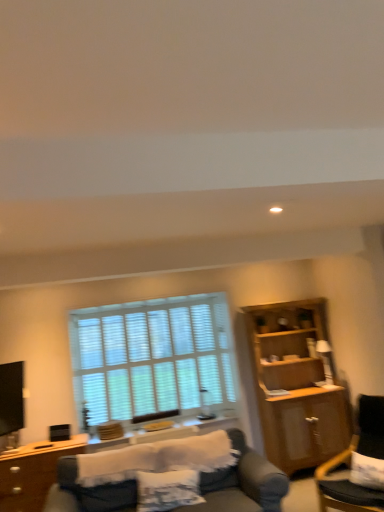
Describe the element at coordinates (153, 357) in the screenshot. This screenshot has height=512, width=384. I see `white wood blinds at center` at that location.

The image size is (384, 512). What are the coordinates of `wooden side table at lower center` in the screenshot? It's located at (167, 432).

Is dark gray fabric chair at lower right bigger than wooden cabinet at right?

No, dark gray fabric chair at lower right is not bigger than wooden cabinet at right.

From a real-world perspective, is dark gray fabric chair at lower right under wooden cabinet at right?

Yes, from a real-world perspective, dark gray fabric chair at lower right is beneath wooden cabinet at right.

Is dark gray fabric chair at lower right touching wooden cabinet at right?

No, dark gray fabric chair at lower right is not making contact with wooden cabinet at right.

In the image, there is a wooden cabinet at right. In order to click on chair below it (from a real-world perspective) in this screenshot , I will do `click(350, 461)`.

Could wooden side table at lower center be considered to be inside wooden cabinet at right?

Actually, wooden side table at lower center is outside wooden cabinet at right.

From a real-world perspective, is wooden cabinet at right above or below wooden side table at lower center?

wooden cabinet at right is situated higher than wooden side table at lower center in the real world.

How different are the orientations of wooden cabinet at right and wooden side table at lower center in degrees?

The angle between the facing direction of wooden cabinet at right and the facing direction of wooden side table at lower center is 1.45 degrees.

Considering the sizes of objects white wood blinds at center and wooden side table at lower center in the image provided, who is thinner, white wood blinds at center or wooden side table at lower center?

With smaller width is white wood blinds at center.

Does white wood blinds at center contain wooden side table at lower center?

No.

Could you tell me if white wood blinds at center is turned towards wooden side table at lower center?

Yes, white wood blinds at center is facing wooden side table at lower center.

Between brown wood desk at lower left and dark gray fabric chair at lower right, which one appears on the left side from the viewer's perspective?

Positioned to the left is brown wood desk at lower left.

Is brown wood desk at lower left further to camera compared to dark gray fabric chair at lower right?

That is True.

From the image's perspective, is brown wood desk at lower left on dark gray fabric chair at lower right?

No, from the image's perspective, brown wood desk at lower left is not on top of dark gray fabric chair at lower right.

From the picture: Is brown wood desk at lower left far away from dark gray fabric chair at lower right?

Indeed, brown wood desk at lower left is not near dark gray fabric chair at lower right.

Could you tell me if dark gray fabric chair at lower right is facing brown wood desk at lower left?

No, dark gray fabric chair at lower right is not facing towards brown wood desk at lower left.

Considering the relative sizes of dark gray fabric chair at lower right and brown wood desk at lower left in the image provided, is dark gray fabric chair at lower right smaller than brown wood desk at lower left?

Incorrect, dark gray fabric chair at lower right is not smaller in size than brown wood desk at lower left.

In the image, is dark gray fabric chair at lower right on the left side or the right side of brown wood desk at lower left?

In the image, dark gray fabric chair at lower right appears on the right side of brown wood desk at lower left.

Locate an element on the screen. This screenshot has height=512, width=384. chair to the right of brown wood desk at lower left is located at coordinates (350, 461).

You are a GUI agent. You are given a task and a screenshot of the screen. Output one action in this format:
    pyautogui.click(x=<x>, y=<y>)
    Task: Click on the chair above the wooden side table at lower center (from the image's perspective)
    
    Given the screenshot: What is the action you would take?
    pyautogui.click(x=350, y=461)

Consider the image. Considering the sizes of objects wooden side table at lower center and dark gray fabric chair at lower right in the image provided, who is smaller, wooden side table at lower center or dark gray fabric chair at lower right?

With smaller size is wooden side table at lower center.

Consider the image. Which is closer to the camera, (131, 437) or (321, 476)?

The point (321, 476) is closer to the camera.

In the image, is wooden side table at lower center positioned in front of or behind dark gray fabric chair at lower right?

wooden side table at lower center is behind dark gray fabric chair at lower right.

Is wooden side table at lower center facing away from brown wood desk at lower left?

wooden side table at lower center is not turned away from brown wood desk at lower left.

From the image's perspective, which one is positioned higher, wooden side table at lower center or brown wood desk at lower left?

wooden side table at lower center appears higher in the image.

In the scene shown: Between wooden side table at lower center and brown wood desk at lower left, which one has less height?

Standing shorter between the two is wooden side table at lower center.

From a real-world perspective, which object stands above the other?

In real-world perspective, wooden side table at lower center is above.

Locate an element on the screen. chair in front of the wooden cabinet at right is located at coordinates (350, 461).

The image size is (384, 512). I want to click on side table below the wooden cabinet at right (from the image's perspective), so click(167, 432).

When comparing their distances from brown wood desk at lower left, does white wood blinds at center or wooden side table at lower center seem further?

white wood blinds at center is positioned further to the anchor brown wood desk at lower left.

From the image, which object appears to be nearer to wooden cabinet at right, dark gray fabric chair at lower right or brown wood desk at lower left?

dark gray fabric chair at lower right lies closer to wooden cabinet at right than the other object.

Looking at the image, which one is located closer to white wood blinds at center, brown wood desk at lower left or wooden side table at lower center?

The object closer to white wood blinds at center is wooden side table at lower center.

Estimate the real-world distances between objects in this image. Which object is further from white wood blinds at center, wooden cabinet at right or dark gray fabric chair at lower right?

The object further to white wood blinds at center is dark gray fabric chair at lower right.

Considering their positions, is wooden cabinet at right positioned further to dark gray fabric chair at lower right than white wood blinds at center?

The object further to dark gray fabric chair at lower right is white wood blinds at center.

Considering their positions, is white wood blinds at center positioned closer to wooden cabinet at right than brown wood desk at lower left?

white wood blinds at center is closer to wooden cabinet at right.

When comparing their distances from dark gray fabric chair at lower right, does wooden side table at lower center or brown wood desk at lower left seem closer?

Based on the image, wooden side table at lower center appears to be nearer to dark gray fabric chair at lower right.

Considering their positions, is wooden side table at lower center positioned further to brown wood desk at lower left than dark gray fabric chair at lower right?

dark gray fabric chair at lower right.

The height and width of the screenshot is (512, 384). Find the location of `cabinetry between brown wood desk at lower left and dark gray fabric chair at lower right in the horizontal direction`. cabinetry between brown wood desk at lower left and dark gray fabric chair at lower right in the horizontal direction is located at coordinates (295, 385).

In order to click on side table located between brown wood desk at lower left and wooden cabinet at right in the left-right direction in this screenshot , I will do `click(167, 432)`.

Image resolution: width=384 pixels, height=512 pixels. In order to click on side table between white wood blinds at center and wooden cabinet at right in this screenshot , I will do `click(167, 432)`.

Locate an element on the screen. The image size is (384, 512). window between brown wood desk at lower left and dark gray fabric chair at lower right is located at coordinates (153, 357).